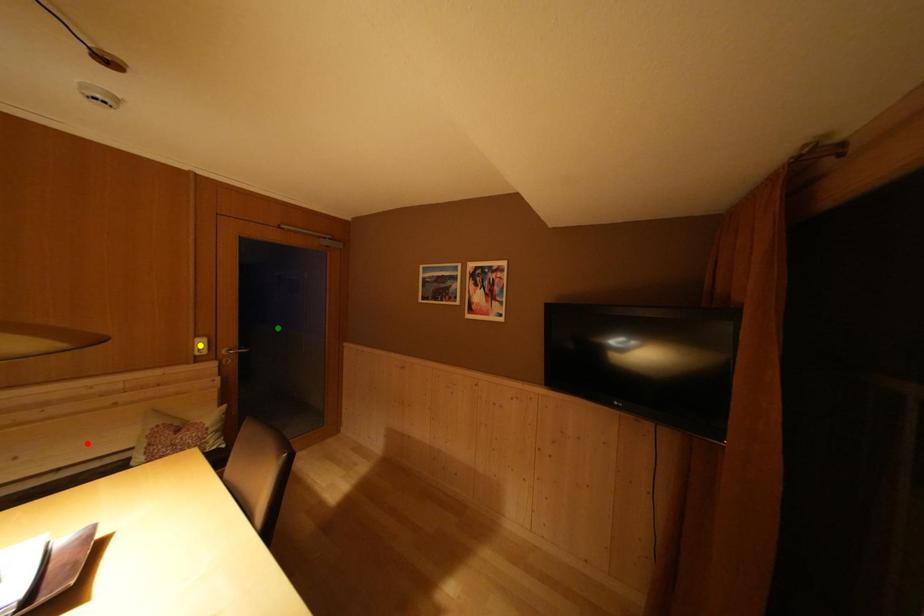
Order these from nearest to farthest:
1. yellow point
2. red point
3. green point

green point < yellow point < red point